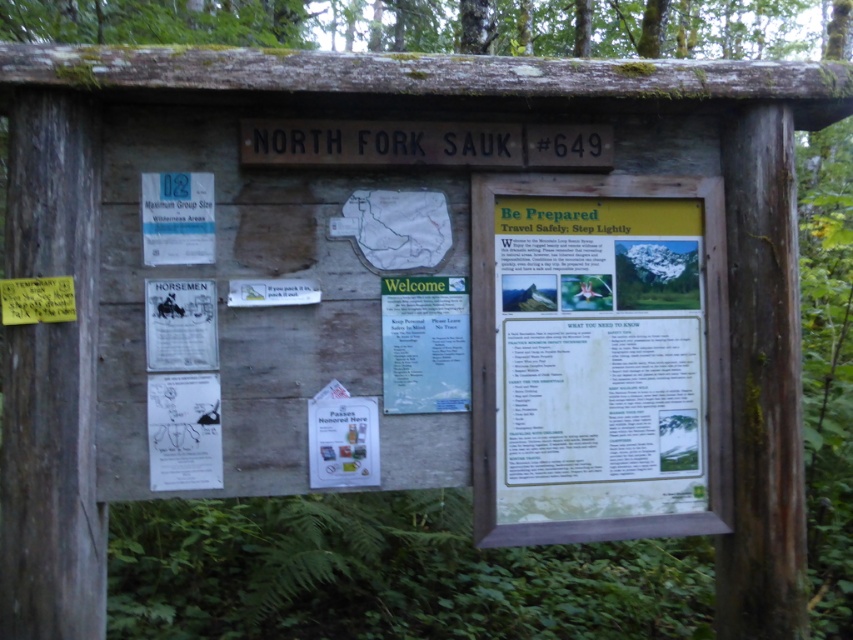
Question: Is green paper poster at center wider than white paper poster at center?

Choices:
 (A) no
 (B) yes

Answer: (B)

Question: Which is farther from the white paper poster at lower left?

Choices:
 (A) green paper poster at center
 (B) white paper poster at center
 (C) white paper at upper left

Answer: (A)

Question: Which object is the farthest from the white paper poster at center?

Choices:
 (A) white paper at upper left
 (B) matte yellow poster at center right
 (C) green paper poster at center

Answer: (B)

Question: Which point is farther to the camera?

Choices:
 (A) (202, 384)
 (B) (170, 216)
 (C) (584, 440)
 (D) (309, 403)

Answer: (C)

Question: Considering the relative positions of matte yellow poster at center right and white paper poster at lower left in the image provided, where is matte yellow poster at center right located with respect to white paper poster at lower left?

Choices:
 (A) above
 (B) below

Answer: (A)

Question: Does matte yellow poster at center right appear under white paper at upper left?

Choices:
 (A) yes
 (B) no

Answer: (A)